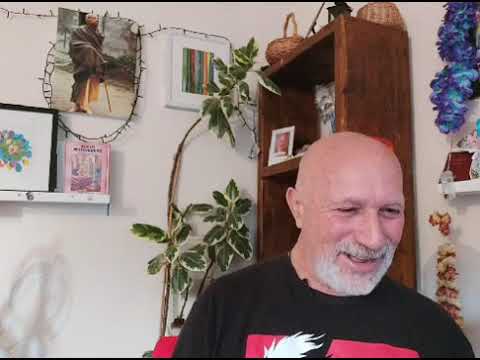
Where is `picture`? This screenshot has width=480, height=360. picture is located at coordinates (44, 148), (117, 84).